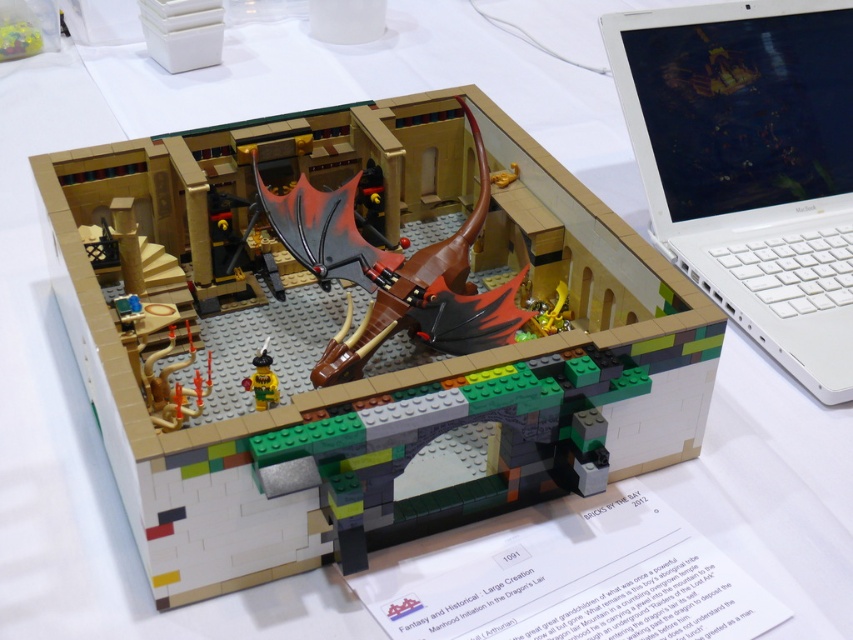
You are a GUI agent. You are given a task and a screenshot of the screen. Output one action in this format:
    pyautogui.click(x=<x>, y=<y>)
    Task: Click on the white plastic laptop at upper right
    The height and width of the screenshot is (640, 853).
    Given the screenshot: What is the action you would take?
    pyautogui.click(x=751, y=164)

Which of these two, white plastic laptop at upper right or shiny metallic dragon at center, stands taller?

With more height is white plastic laptop at upper right.

Is point (776, 211) less distant than point (357, 241)?

No, it is not.

Locate an element on the screen. The image size is (853, 640). white plastic laptop at upper right is located at coordinates click(x=751, y=164).

Measure the distance between point [260,180] and camera.

Point [260,180] and camera are 35.24 inches apart from each other.

Is shiny metallic dragon at center below bright yellow plastic minifigure at center?

Incorrect, shiny metallic dragon at center is not positioned below bright yellow plastic minifigure at center.

Is point (436, 291) farther from viewer compared to point (257, 381)?

Yes, point (436, 291) is behind point (257, 381).

Find the location of a particular element. shiny metallic dragon at center is located at coordinates (393, 275).

Which is more to the left, white plastic laptop at upper right or bright yellow plastic minifigure at center?

bright yellow plastic minifigure at center

Who is more distant from viewer, (682, 176) or (270, 392)?

The point (682, 176) is more distant.

You are a GUI agent. You are given a task and a screenshot of the screen. Output one action in this format:
    pyautogui.click(x=<x>, y=<y>)
    Task: Click on the white plastic laptop at upper right
    Image resolution: width=853 pixels, height=640 pixels.
    Given the screenshot: What is the action you would take?
    pyautogui.click(x=751, y=164)